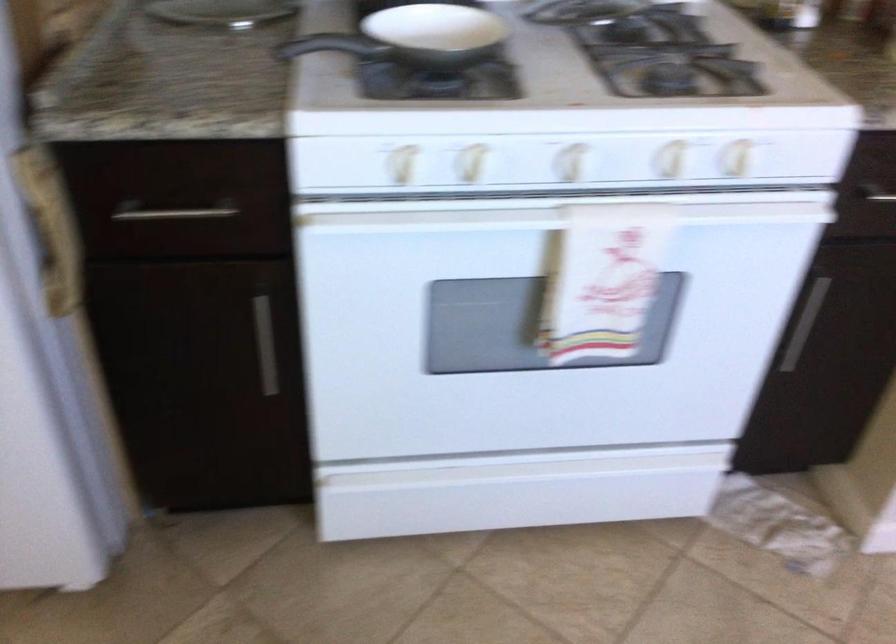
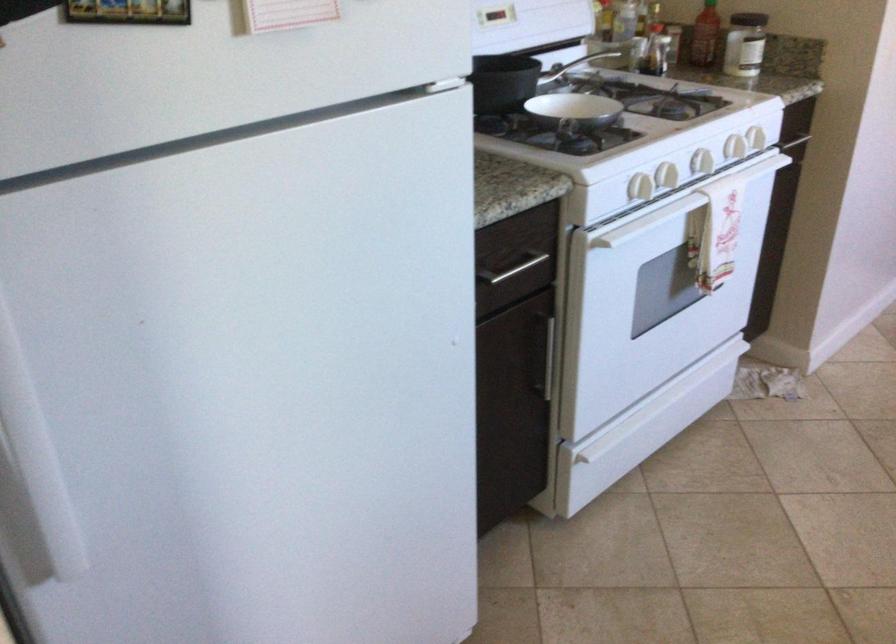
Find the pixel in the second image that matches the point at 511,207 in the first image.

(702, 162)